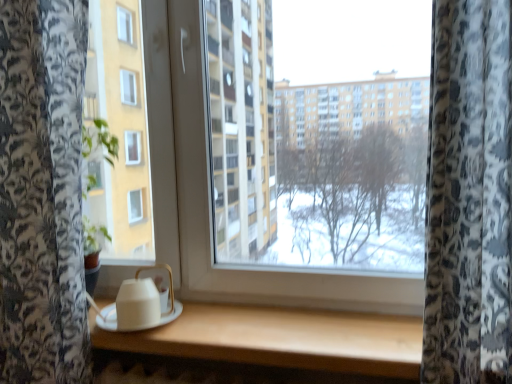
In order to click on empty space that is to the right of white matte teapot at lower left in this screenshot , I will do `click(214, 319)`.